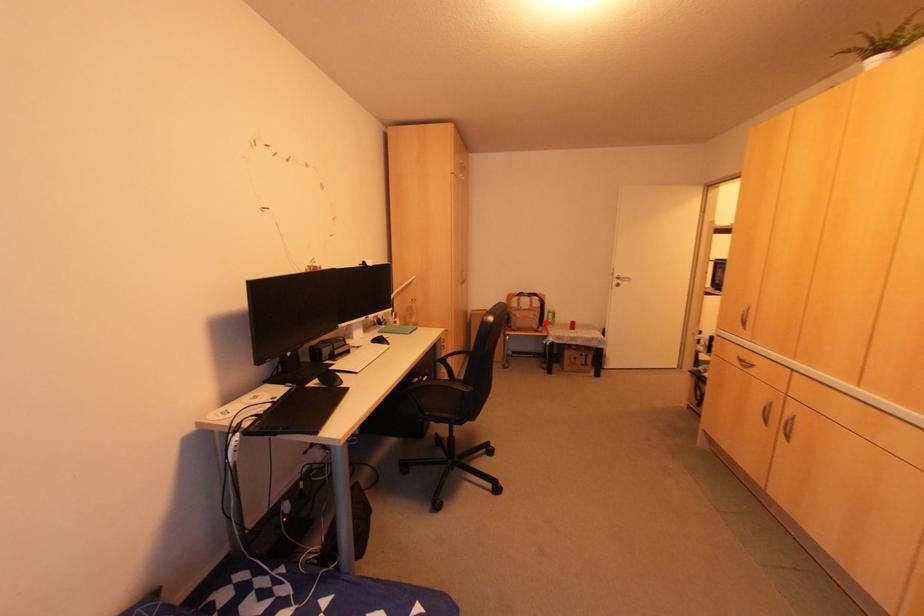
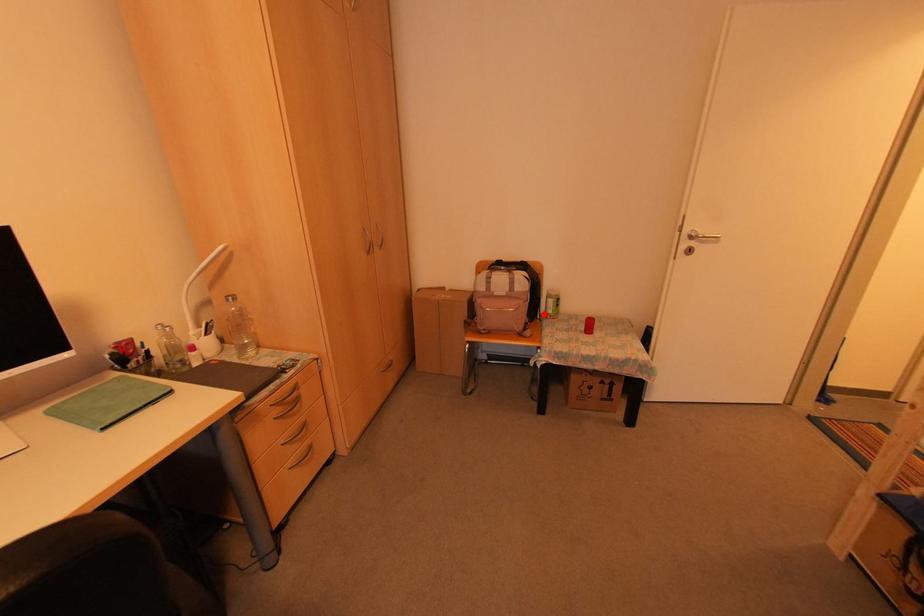
I am providing you with two images of the same scene from different viewpoints. A red point is marked on the first image and another point is marked on the second image. Are the points marked in image1 and image2 representing the same 3D position?

Yes